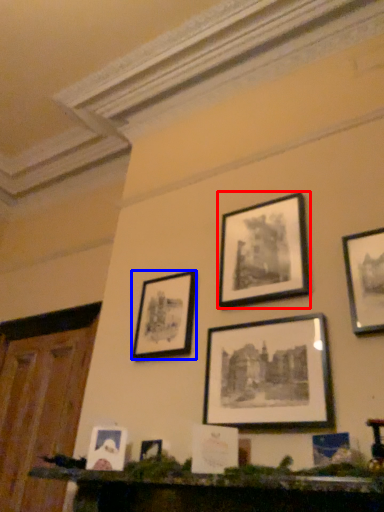
Question: Which of the following is the closest to the observer, picture frame (highlighted by a red box) or picture frame (highlighted by a blue box)?

Choices:
 (A) picture frame
 (B) picture frame

Answer: (A)